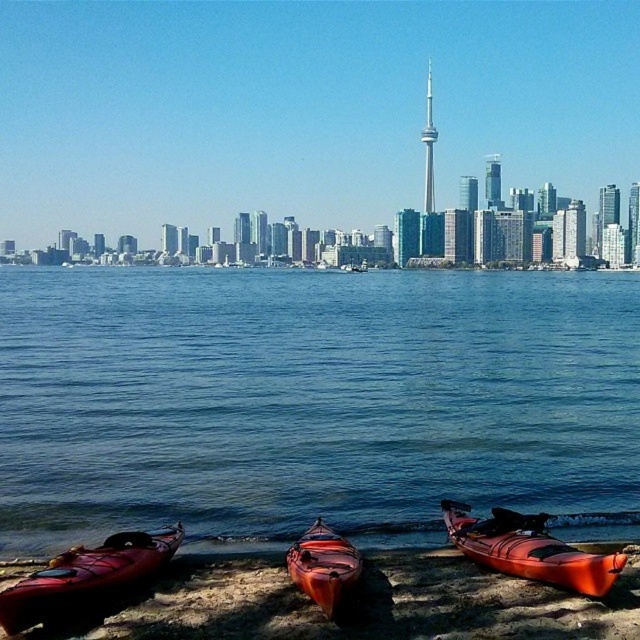
Does blue water at lower center appear on the right side of orange matte kayak at lower right?

Yes, blue water at lower center is to the right of orange matte kayak at lower right.

Which is behind, point (493, 397) or point (556, 544)?

Positioned behind is point (493, 397).

In the scene shown: Who is more distant from viewer, (384, 509) or (516, 564)?

Point (384, 509)

You are a GUI agent. You are given a task and a screenshot of the screen. Output one action in this format:
    pyautogui.click(x=<x>, y=<y>)
    Task: Click on the blue water at lower center
    The height and width of the screenshot is (640, 640).
    Given the screenshot: What is the action you would take?
    pyautogui.click(x=312, y=401)

Who is lower down, blue water at lower center or orange matte kayak at center?

Positioned lower is orange matte kayak at center.

Is blue water at lower center wider than orange matte kayak at center?

Yes, blue water at lower center is wider than orange matte kayak at center.

Is point (26, 285) farther from viewer compared to point (291, 570)?

Yes, it is behind point (291, 570).

Find the location of a particular element. blue water at lower center is located at coordinates (312, 401).

Who is positioned more to the right, matte orange canoe at lower left or orange matte kayak at center?

From the viewer's perspective, orange matte kayak at center appears more on the right side.

Which is in front, point (4, 611) or point (323, 554)?

Point (4, 611) is more forward.

The image size is (640, 640). What do you see at coordinates (86, 577) in the screenshot?
I see `matte orange canoe at lower left` at bounding box center [86, 577].

I want to click on matte orange canoe at lower left, so click(86, 577).